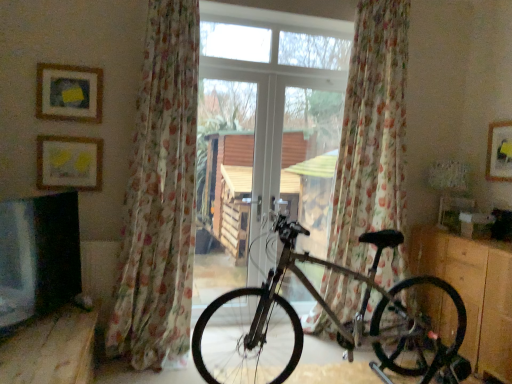
Question: Does matte gold picture frame at upper left, which ranks as the 1th picture frame in front-to-back order, have a smaller size compared to wooden dresser at lower right?

Choices:
 (A) yes
 (B) no

Answer: (A)

Question: Would you say matte gold picture frame at upper left, which ranks as the 1th picture frame in front-to-back order, is outside wooden dresser at lower right?

Choices:
 (A) yes
 (B) no

Answer: (A)

Question: From the image's perspective, does matte gold picture frame at upper left, the second picture frame in the right-to-left sequence, appear higher than wooden dresser at lower right?

Choices:
 (A) yes
 (B) no

Answer: (A)

Question: Is matte gold picture frame at upper left, which is counted as the second picture frame, starting from the left, further to the viewer compared to wooden dresser at lower right?

Choices:
 (A) no
 (B) yes

Answer: (B)

Question: Does matte gold picture frame at upper left, which ranks as the 1th picture frame in front-to-back order, have a greater width compared to wooden dresser at lower right?

Choices:
 (A) no
 (B) yes

Answer: (A)

Question: Is wooden dresser at lower right at the back of matte gold picture frame at upper left, the second picture frame in the right-to-left sequence?

Choices:
 (A) yes
 (B) no

Answer: (B)

Question: Is floral sheer curtain at center, which is counted as the 2th curtain, starting from the left, to the right of wooden bench at lower left from the viewer's perspective?

Choices:
 (A) no
 (B) yes

Answer: (B)

Question: Is floral sheer curtain at center, the 1th curtain positioned from the right, thinner than wooden bench at lower left?

Choices:
 (A) yes
 (B) no

Answer: (A)

Question: Is wooden bench at lower left completely or partially inside floral sheer curtain at center, which is counted as the 2th curtain, starting from the left?

Choices:
 (A) no
 (B) yes

Answer: (A)

Question: Does floral sheer curtain at center, the 1th curtain positioned from the right, have a greater height compared to wooden bench at lower left?

Choices:
 (A) no
 (B) yes

Answer: (B)

Question: From the image's perspective, would you say floral sheer curtain at center, the 1th curtain positioned from the right, is shown under wooden bench at lower left?

Choices:
 (A) no
 (B) yes

Answer: (A)

Question: From a real-world perspective, is floral sheer curtain at center, which is counted as the 2th curtain, starting from the left, positioned under wooden bench at lower left based on gravity?

Choices:
 (A) no
 (B) yes

Answer: (A)

Question: Is wooden dresser at lower right further to camera compared to matte gold picture frame at upper left, positioned as the 3th picture frame in back-to-front order?

Choices:
 (A) yes
 (B) no

Answer: (B)